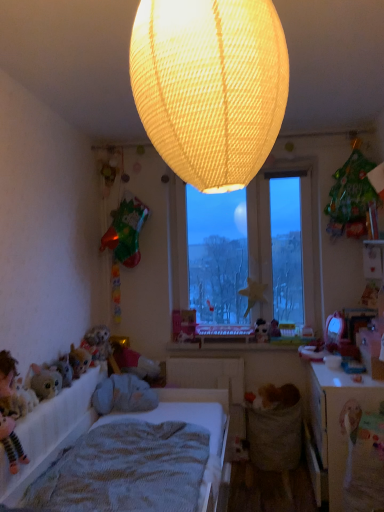
What are the coordinates of `blank space to the left of matte plastic toy at center, the second toy when ordered from front to back` in the screenshot? It's located at (246, 343).